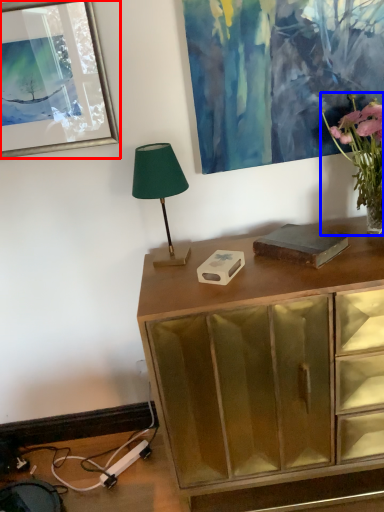
Question: Which point is further to the camera, picture frame (highlighted by a red box) or houseplant (highlighted by a blue box)?

Choices:
 (A) picture frame
 (B) houseplant

Answer: (A)